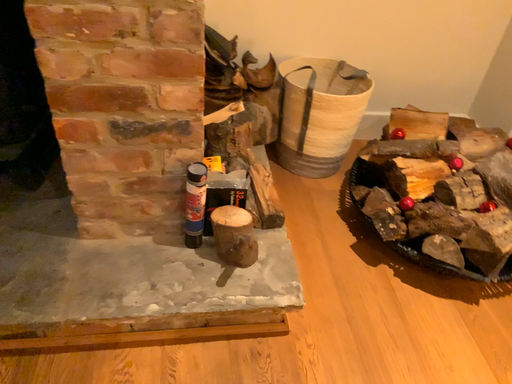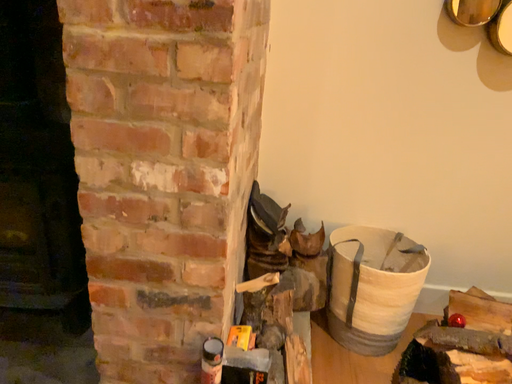
Question: How did the camera likely rotate when shooting the video?

Choices:
 (A) rotated downward
 (B) rotated upward

Answer: (B)